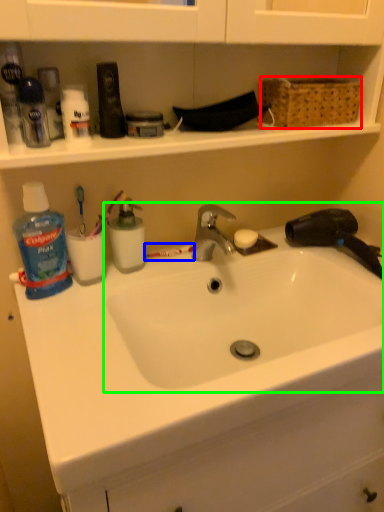
Question: Estimate the real-world distances between objects in this image. Which object is farther from basket (highlighted by a red box), toothbrush (highlighted by a blue box) or sink (highlighted by a green box)?

Choices:
 (A) toothbrush
 (B) sink

Answer: (A)